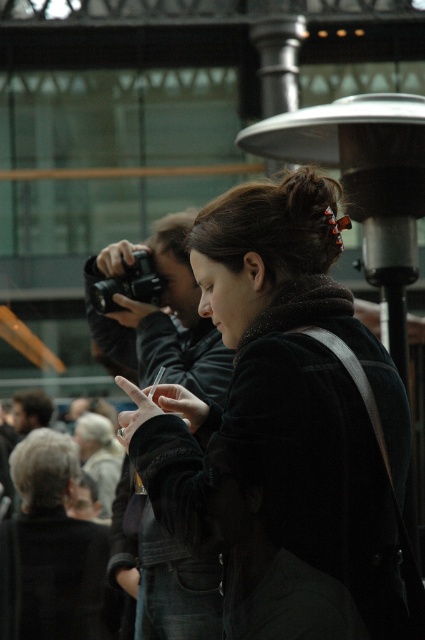
Does dark brown leather jacket at center have a greater width compared to matte black camera at center?

In fact, dark brown leather jacket at center might be narrower than matte black camera at center.

Can you confirm if dark brown leather jacket at center is bigger than matte black camera at center?

Incorrect, dark brown leather jacket at center is not larger than matte black camera at center.

This screenshot has height=640, width=425. I want to click on dark brown leather jacket at center, so click(282, 426).

Does dark brown leather jacket at center have a lesser height compared to black plastic camera at upper left?

Incorrect, dark brown leather jacket at center's height does not fall short of black plastic camera at upper left's.

Measure the distance between dark brown leather jacket at center and camera.

dark brown leather jacket at center is 14.74 meters from camera.

I want to click on dark brown leather jacket at center, so click(282, 426).

Is matte black camera at center in front of black plastic camera at upper left?

That is True.

Between point (218, 616) and point (112, 300), which one is positioned behind?

Point (112, 300)

Image resolution: width=425 pixels, height=640 pixels. Find the location of `matte black camera at center`. matte black camera at center is located at coordinates (161, 316).